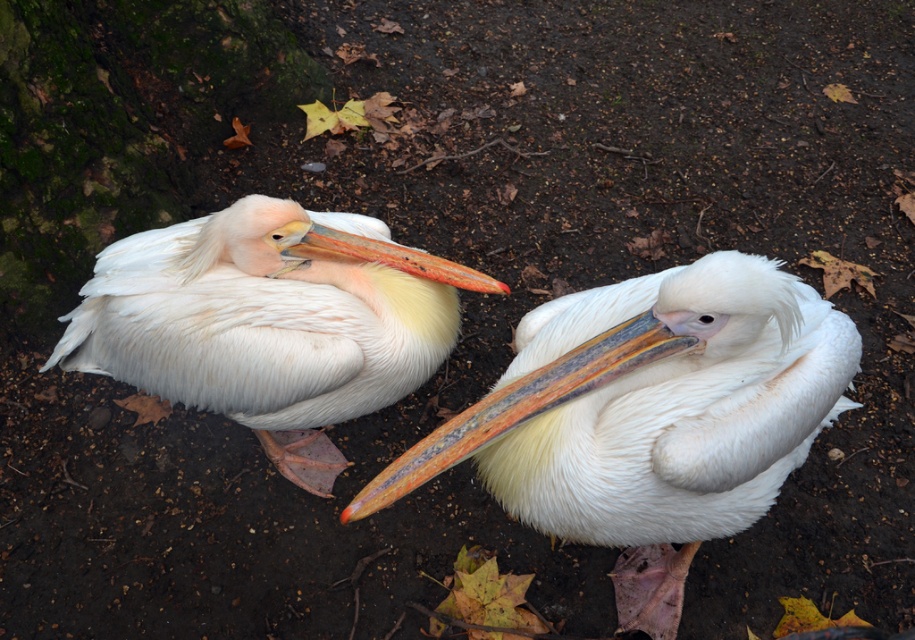
Question: Observing the image, what is the correct spatial positioning of white feathered pelican at center in reference to white feathered pelican at left?

Choices:
 (A) left
 (B) right

Answer: (B)

Question: Among these points, which one is farthest from the camera?

Choices:
 (A) 784,424
 (B) 105,356

Answer: (B)

Question: Which of the following is the closest to the observer?

Choices:
 (A) white feathered pelican at left
 (B) white feathered pelican at center

Answer: (B)

Question: Is white feathered pelican at center above white feathered pelican at left?

Choices:
 (A) no
 (B) yes

Answer: (A)

Question: Does white feathered pelican at center come behind white feathered pelican at left?

Choices:
 (A) no
 (B) yes

Answer: (A)